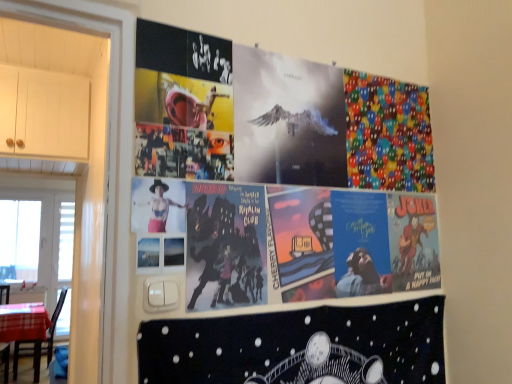
Question: In the image, is brown wooden chair at lower left on the left side or the right side of black matte poster at lower center?

Choices:
 (A) right
 (B) left

Answer: (B)

Question: Is brown wooden chair at lower left situated inside black matte poster at lower center or outside?

Choices:
 (A) inside
 (B) outside

Answer: (B)

Question: Estimate the real-world distances between objects in this image. Which object is farther from the colorful fabric pac-man at upper right?

Choices:
 (A) brown wooden chair at lower left
 (B) matte black figure at center
 (C) transparent glass window at left, positioned as the first window screen in left-to-right order
 (D) metallic silver poster at center
 (E) black matte poster at lower center

Answer: (C)

Question: Estimate the real-world distances between objects in this image. Which object is farther from the brown wooden chair at lower left?

Choices:
 (A) white plastic window screen at left, the first window screen viewed from the front
 (B) black matte poster at lower center
 (C) matte black figure at center
 (D) transparent glass window at left, the first window screen positioned from the back
 (E) colorful fabric pac-man at upper right

Answer: (C)